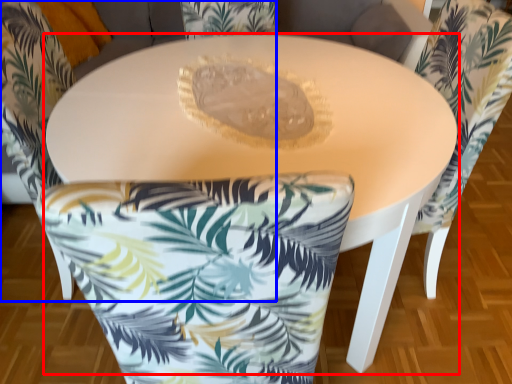
Question: Which point is closer to the camera, table (highlighted by a red box) or chair (highlighted by a blue box)?

Choices:
 (A) table
 (B) chair

Answer: (A)